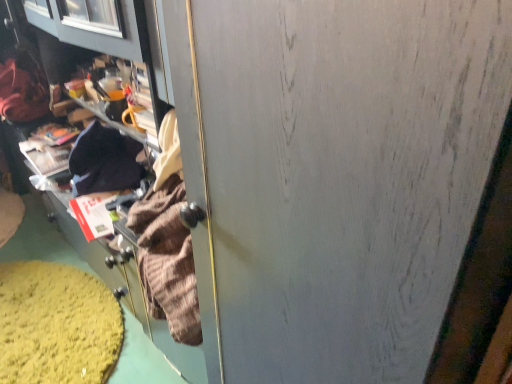
Question: Is velvet-like brown sweater at left wider or thinner than cardboard box at lower left?

Choices:
 (A) thin
 (B) wide

Answer: (A)

Question: Do you think velvet-like brown sweater at left is within cardboard box at lower left, or outside of it?

Choices:
 (A) inside
 (B) outside

Answer: (B)

Question: From the image's perspective, is velvet-like brown sweater at left located above or below cardboard box at lower left?

Choices:
 (A) below
 (B) above

Answer: (B)

Question: Is cardboard box at lower left to the left or to the right of velvet-like brown sweater at left in the image?

Choices:
 (A) right
 (B) left

Answer: (A)

Question: Would you say cardboard box at lower left is inside or outside velvet-like brown sweater at left?

Choices:
 (A) inside
 (B) outside

Answer: (B)

Question: In terms of width, does cardboard box at lower left look wider or thinner when compared to velvet-like brown sweater at left?

Choices:
 (A) wide
 (B) thin

Answer: (A)

Question: From the image's perspective, is cardboard box at lower left positioned above or below velvet-like brown sweater at left?

Choices:
 (A) below
 (B) above

Answer: (A)